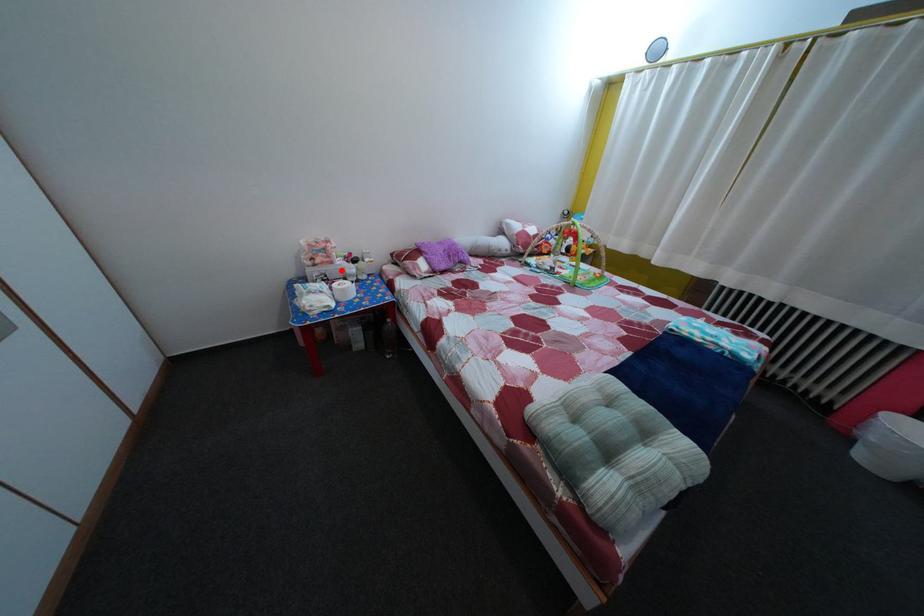
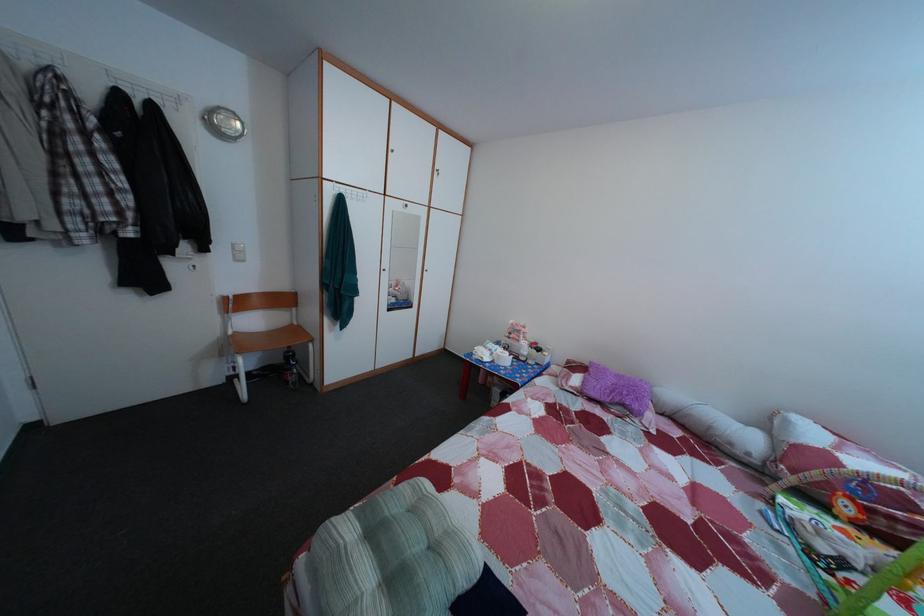
In the second image, find the point that corresponds to the highlighted location in the first image.

(528, 349)